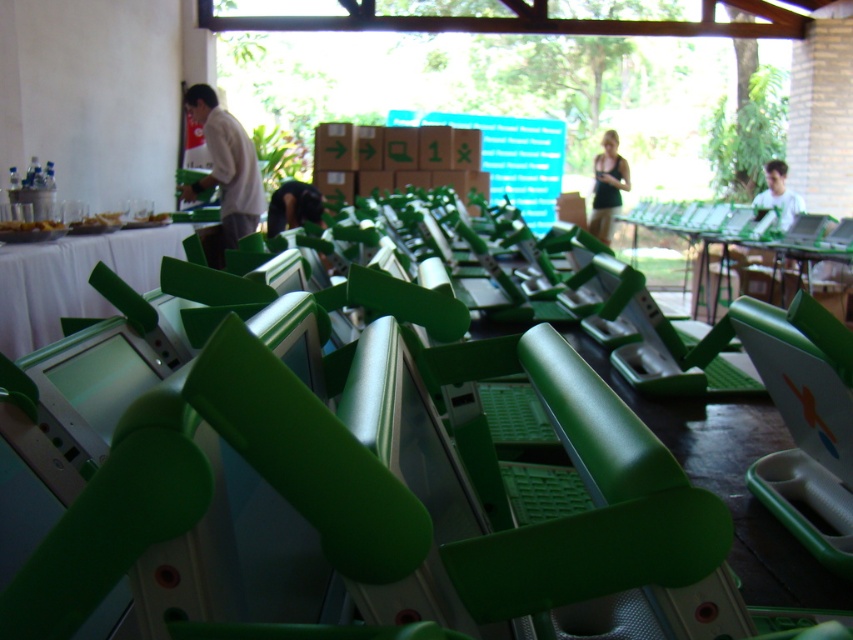
Question: Does green plastic folding chair at center appear over dark green plastic person at center?

Choices:
 (A) no
 (B) yes

Answer: (A)

Question: Which object is farther from the camera taking this photo?

Choices:
 (A) dark green plastic person at center
 (B) green plastic folding chair at center
 (C) matte white shirt at center
 (D) green plastic laptop at upper right

Answer: (D)

Question: Which of the following is the closest to the observer?

Choices:
 (A) black fabric shirt at center
 (B) green plastic table at center
 (C) matte white shirt at center

Answer: (B)

Question: Estimate the real-world distances between objects in this image. Which object is farther from the green plastic table at center?

Choices:
 (A) matte white shirt at center
 (B) green plastic laptop at upper right
 (C) black fabric shirt at center
 (D) green plastic folding chair at center

Answer: (C)

Question: Is black fabric shirt at center closer to camera compared to green plastic laptop at upper right?

Choices:
 (A) yes
 (B) no

Answer: (B)

Question: From the image, what is the correct spatial relationship of matte white shirt at center in relation to dark green plastic person at center?

Choices:
 (A) right
 (B) left

Answer: (B)